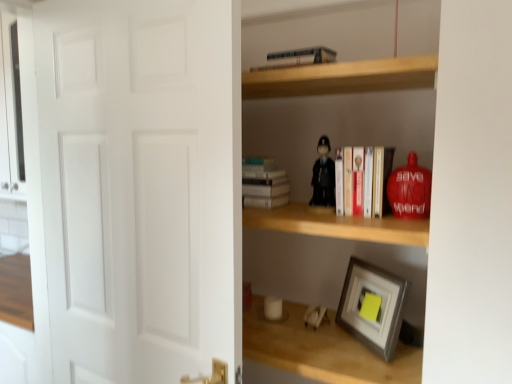
Question: Is wooden shelf at lower right, positioned as the 1th shelf in bottom-to-top order, further to the viewer compared to hardcover books at center, acting as the second book starting from the top?

Choices:
 (A) yes
 (B) no

Answer: (B)

Question: Is wooden shelf at lower right, the second shelf from the top, bigger than hardcover books at center, positioned as the first book in right-to-left order?

Choices:
 (A) no
 (B) yes

Answer: (B)

Question: From the image's perspective, would you say wooden shelf at lower right, positioned as the 1th shelf in bottom-to-top order, is shown under hardcover books at center, acting as the second book starting from the top?

Choices:
 (A) yes
 (B) no

Answer: (A)

Question: Can you confirm if wooden shelf at lower right, the second shelf from the top, is taller than hardcover books at center, arranged as the first book when ordered from the bottom?

Choices:
 (A) yes
 (B) no

Answer: (B)

Question: Is wooden shelf at lower right, the second shelf from the top, positioned beyond the bounds of hardcover books at center, acting as the second book starting from the top?

Choices:
 (A) no
 (B) yes

Answer: (B)

Question: From the image's perspective, is white matte door at left above or below metallic silver train at upper center, acting as the 2th book starting from the right?

Choices:
 (A) above
 (B) below

Answer: (B)

Question: Would you say white matte door at left is to the left or to the right of metallic silver train at upper center, marked as the second book in a bottom-to-top arrangement, in the picture?

Choices:
 (A) right
 (B) left

Answer: (B)

Question: Considering the positions of white matte door at left and metallic silver train at upper center, the 1th book positioned from the top, in the image, is white matte door at left wider or thinner than metallic silver train at upper center, the 1th book positioned from the top,?

Choices:
 (A) thin
 (B) wide

Answer: (A)

Question: Is white matte door at left inside or outside of metallic silver train at upper center, acting as the 2th book starting from the right?

Choices:
 (A) inside
 (B) outside

Answer: (B)

Question: Considering the positions of white matte door at left and wooden shelf at center, the first shelf when ordered from top to bottom, in the image, is white matte door at left wider or thinner than wooden shelf at center, the first shelf when ordered from top to bottom,?

Choices:
 (A) wide
 (B) thin

Answer: (B)

Question: Considering their positions, is white matte door at left located in front of or behind wooden shelf at center, the second shelf when ordered from bottom to top?

Choices:
 (A) front
 (B) behind

Answer: (A)

Question: Considering the positions of white matte door at left and wooden shelf at center, the first shelf when ordered from top to bottom, in the image, is white matte door at left bigger or smaller than wooden shelf at center, the first shelf when ordered from top to bottom,?

Choices:
 (A) small
 (B) big

Answer: (A)

Question: From a real-world perspective, is white matte door at left physically located above or below wooden shelf at center, the second shelf when ordered from bottom to top?

Choices:
 (A) above
 (B) below

Answer: (B)

Question: From a real-world perspective, is wooden shelf at lower right, positioned as the 1th shelf in bottom-to-top order, above or below white plastic toy at lower center, arranged as the 3th toy when viewed from the right?

Choices:
 (A) below
 (B) above

Answer: (A)

Question: From their relative heights in the image, would you say wooden shelf at lower right, positioned as the 1th shelf in bottom-to-top order, is taller or shorter than white plastic toy at lower center, arranged as the 3th toy when viewed from the top?

Choices:
 (A) short
 (B) tall

Answer: (A)